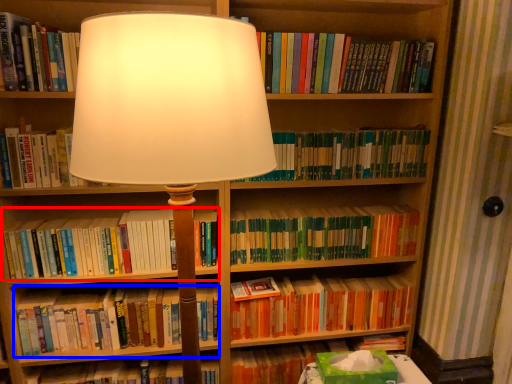
Question: Which of the following is the farthest to the observer, book (highlighted by a red box) or book (highlighted by a blue box)?

Choices:
 (A) book
 (B) book

Answer: (B)